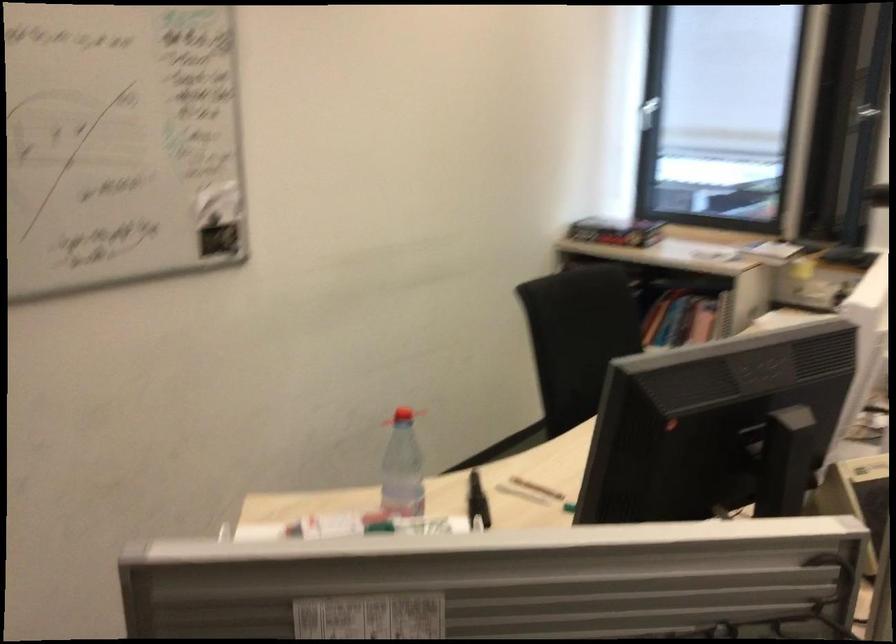
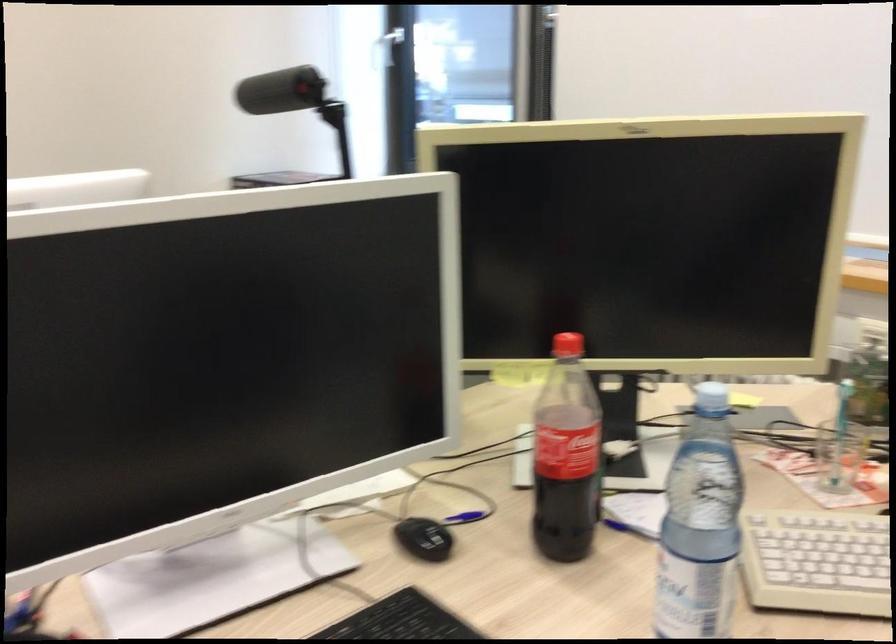
Looking at this image, the images are taken continuously from a first-person perspective. In which direction are you moving?

The movement direction of the cameraman is right, forward.